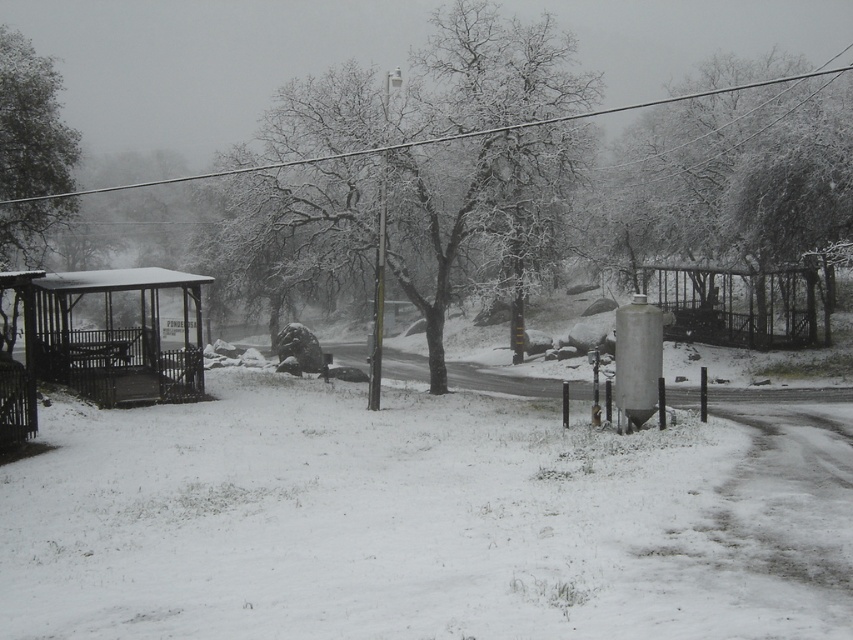
Consider the image. You are standing at the bus stop shelter in the snowy landscape. You see a point marked at coordinates (32, 124). Based on the scene description, can you determine what object this point is located on?

The point at coordinates (32, 124) is located on the snow covered tree at left.